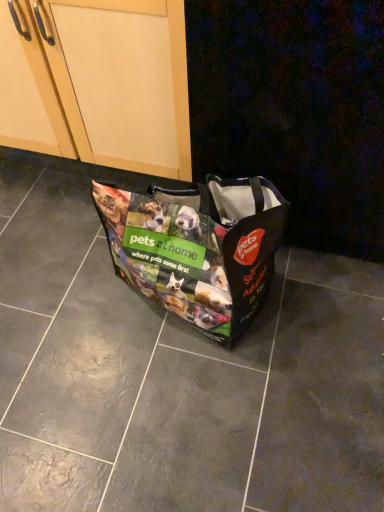
Find the location of `vacant space situated on the left part of polyester tote bag at center`. vacant space situated on the left part of polyester tote bag at center is located at coordinates (57, 295).